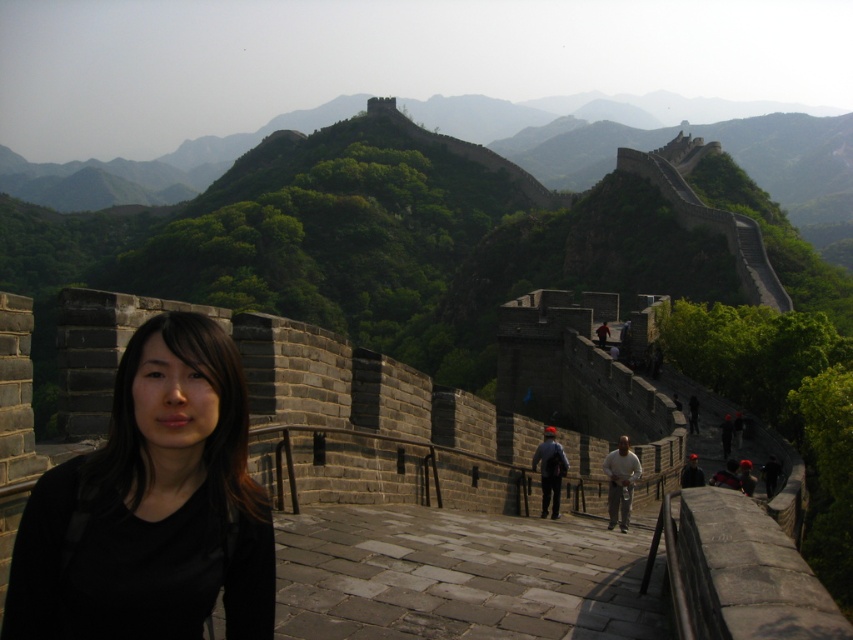
Does point (610, 509) come behind point (556, 492)?

No, (610, 509) is closer to viewer.

Which is above, light brown leather jacket at center or dark gray stone person at center?

Positioned higher is dark gray stone person at center.

Who is more distant from viewer, (624, 435) or (561, 464)?

The point (624, 435) is behind.

This screenshot has width=853, height=640. In order to click on light brown leather jacket at center in this screenshot , I will do `click(619, 483)`.

Is black matte shirt at center below light brown leather jacket at center?

Actually, black matte shirt at center is above light brown leather jacket at center.

Consider the image. Is black matte shirt at center positioned at the back of light brown leather jacket at center?

No.

Measure the distance between point (115, 531) and camera.

Point (115, 531) and camera are 19.59 meters apart from each other.

Where is `black matte shirt at center`? black matte shirt at center is located at coordinates (152, 506).

Is black matte shirt at center below dark gray stone person at center?

Actually, black matte shirt at center is above dark gray stone person at center.

In the scene shown: Which is more to the left, black matte shirt at center or dark gray stone person at center?

black matte shirt at center is more to the left.

Who is more distant from viewer, (x=120, y=456) or (x=567, y=467)?

Positioned behind is point (x=567, y=467).

The image size is (853, 640). What are the coordinates of `black matte shirt at center` in the screenshot? It's located at (152, 506).